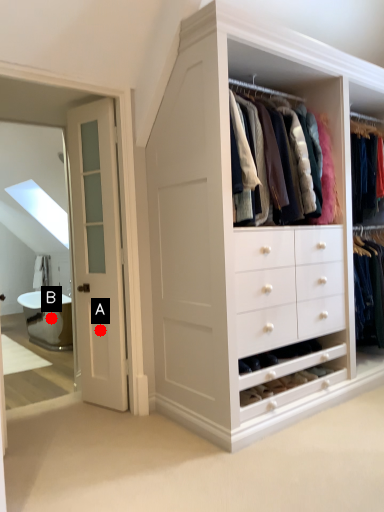
Question: Two points are circled on the image, labeled by A and B beside each circle. Which point is closer to the camera?

Choices:
 (A) A is closer
 (B) B is closer

Answer: (A)